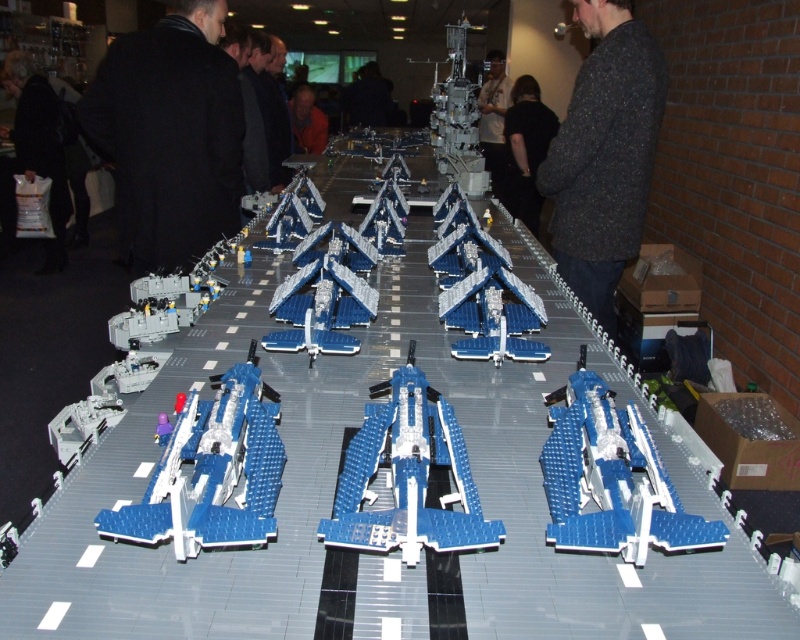
You are a store employee organizing a rack of coats and sweaters. You have a black coat at left and a dark gray sweater at center. Which one should you place on the wider hanger to fit properly?

The black coat at left should be placed on the wider hanger because its width is larger than the dark gray sweater at center.

You are organizing a clothing donation drive and need to determine which item takes up more space. Which of the two items, the black coat at left or the speckled dark gray sweater at upper center, is bigger in size?

The black coat at left has a larger size compared to the speckled dark gray sweater at upper center, so the black coat at left takes up more space.

You are standing at the center of the room looking at the display table. There is a black coat at left. Where is the black coat located relative to the display table?

The black coat at left is located at point (170,134) relative to the display table.